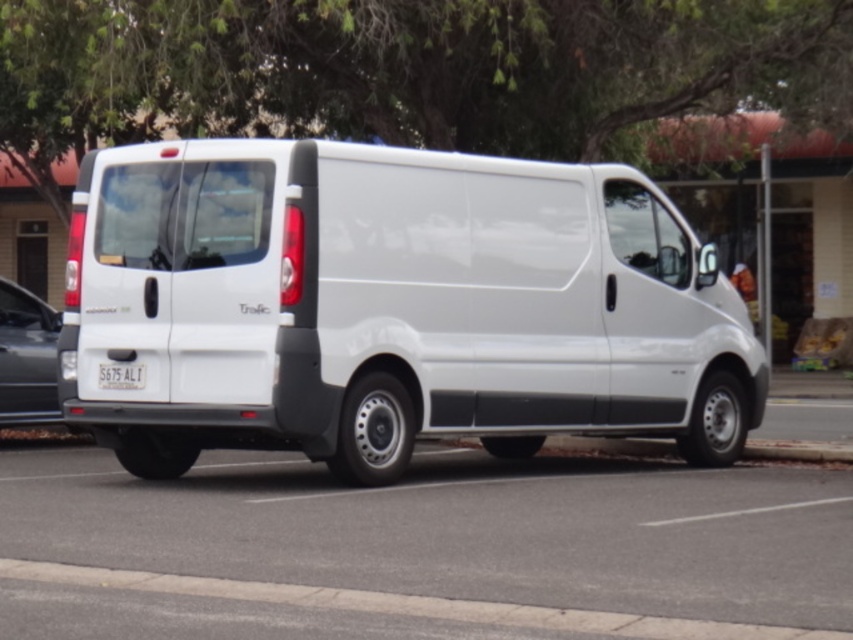
You are a delivery driver who needs to park your vehicle between two other cars. You have a white matte van at center and a matte black car at left. Which vehicle should you choose to park in the space if the available space is only 2.5 meters wide?

The matte black car at left has a smaller width than the white matte van at center. Since the available space is 2.5 meters wide, you should choose the matte black car at left to park in the space because it is narrower and more likely to fit within the limited width.

You are a pedestrian standing on the sidewalk and see the white matte van at center and the matte black car at left. Which vehicle is closer to the ground?

The white matte van at center is closer to the ground because it is positioned below the matte black car at left.

You are a delivery driver who needs to park your white matte van at center in a spot that requires clearance of 2 meters in height. You observe the concrete at lower center, which is part of the parking area. Can you determine if your van will fit based on the height comparison provided?

The white matte van at center is taller than the concrete at lower center. However, without knowing the exact height of the concrete or the van, it is impossible to determine if the van meets the 2 meter clearance requirement. Additional measurements are needed.